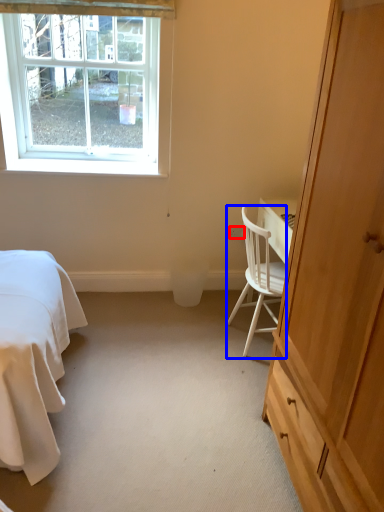
Question: Which point is further to the camera, power outlet (highlighted by a red box) or chair (highlighted by a blue box)?

Choices:
 (A) power outlet
 (B) chair

Answer: (A)